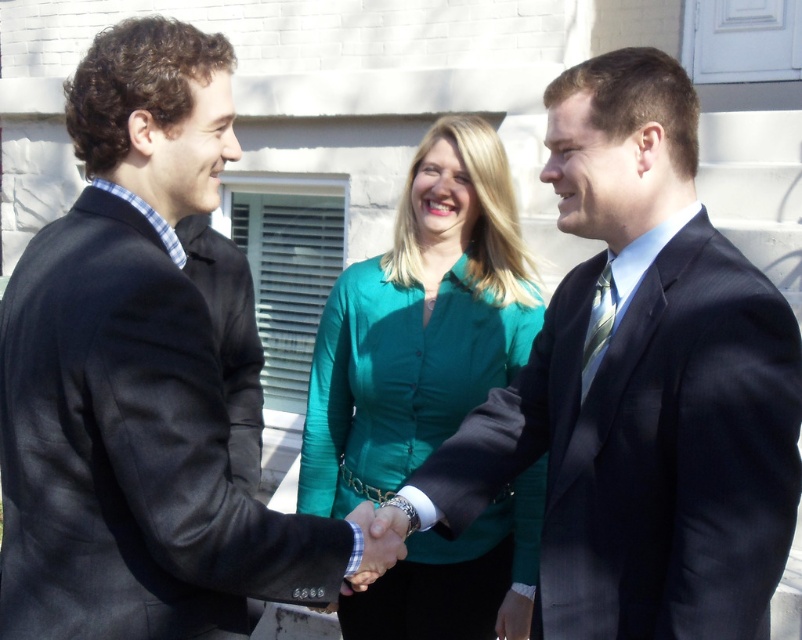
Does black suit at center have a larger size compared to matte silver watch at center?

Yes, black suit at center is bigger than matte silver watch at center.

Where is `black suit at center`? The height and width of the screenshot is (640, 802). black suit at center is located at coordinates (136, 380).

Find the location of a particular element. The width and height of the screenshot is (802, 640). black suit at center is located at coordinates (136, 380).

Is black suit at center wider than green silk blouse at center?

Incorrect, black suit at center's width does not surpass green silk blouse at center's.

Can you confirm if black suit at center is positioned to the left of green silk blouse at center?

Correct, you'll find black suit at center to the left of green silk blouse at center.

Who is more forward, (181, 317) or (416, 180)?

Point (181, 317) is more forward.

Where is `black suit at center`? This screenshot has height=640, width=802. black suit at center is located at coordinates (136, 380).

Can you confirm if green silk blouse at center is wider than matte silver watch at center?

Indeed, green silk blouse at center has a greater width compared to matte silver watch at center.

Is point (407, 384) more distant than point (359, 513)?

Yes, point (407, 384) is behind point (359, 513).

You are a GUI agent. You are given a task and a screenshot of the screen. Output one action in this format:
    pyautogui.click(x=<x>, y=<y>)
    Task: Click on the green silk blouse at center
    This screenshot has height=640, width=802.
    Given the screenshot: What is the action you would take?
    pyautogui.click(x=419, y=324)